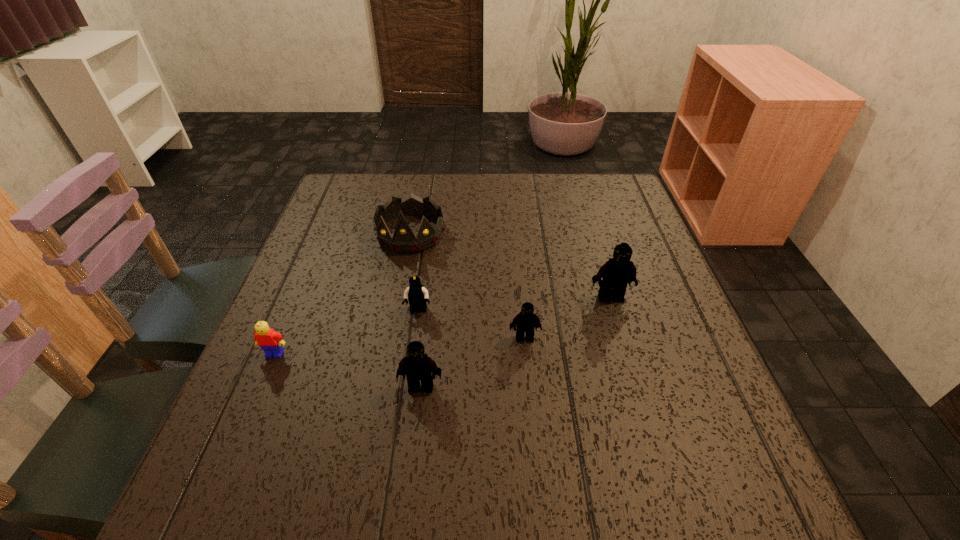
Find the location of a particular element. blank region between the fourth shortest Lego and the leftmost object is located at coordinates (348, 370).

Locate an element on the screen. This screenshot has width=960, height=540. vacant area that lies between the fifth nearest object and the fifth object from left to right is located at coordinates (567, 318).

This screenshot has height=540, width=960. What are the coordinates of `free space between the nearest object and the farthest Lego` in the screenshot? It's located at (516, 342).

Locate an element on the screen. This screenshot has height=540, width=960. free space between the fourth farthest object and the leftmost Lego is located at coordinates (399, 346).

Locate an element on the screen. Image resolution: width=960 pixels, height=540 pixels. object that is the fifth closest one to the farthest object is located at coordinates (419, 366).

Where is `object that is the second nearest to the leftmost Lego`? object that is the second nearest to the leftmost Lego is located at coordinates (419, 366).

Identify which Lego is located as the fourth nearest to the second nearest Lego. Please provide its 2D coordinates. Your answer should be formatted as a tuple, i.e. [(x, y)], where the tuple contains the x and y coordinates of a point satisfying the conditions above.

[(619, 271)]

Identify the location of Lego that is the second closest to the second nearest object. This screenshot has height=540, width=960. (419, 366).